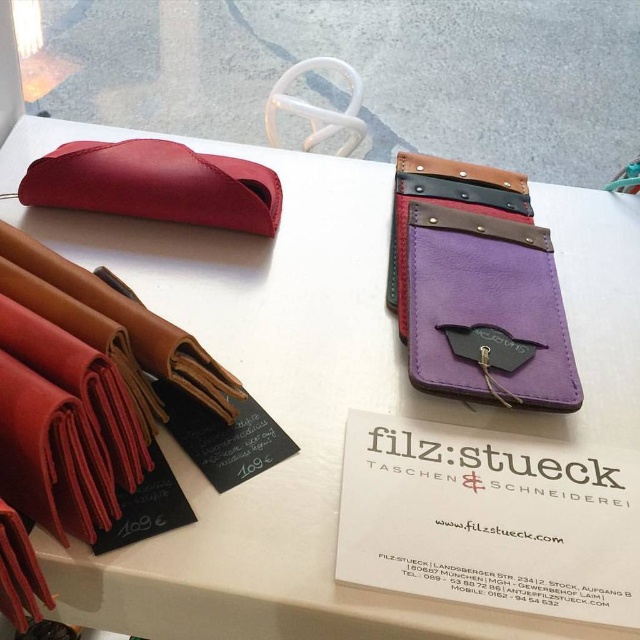
You are organizing a display for a leather goods store. You have a purple leather wallet at upper right and a matte leather pouch at upper left. Which item should you place on the shelf if you need an item with a smaller width?

The purple leather wallet at upper right has a lesser width compared to the matte leather pouch at upper left, so you should place the purple leather wallet at upper right on the shelf since it is narrower.